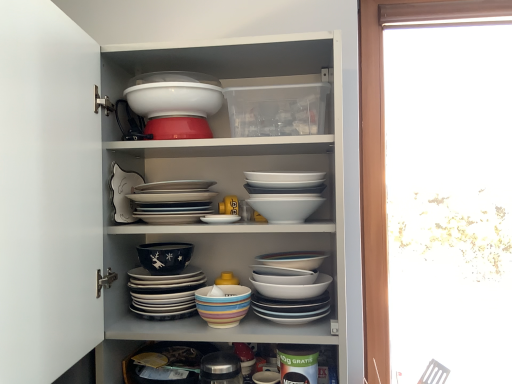
Question: From the image's perspective, is white glossy bowls at center, which is the sixth bowl in bottom-to-top order, positioned above or below white glossy plate at center, positioned as the fourth bowl in top-to-bottom order?

Choices:
 (A) above
 (B) below

Answer: (A)

Question: Based on their positions, is white glossy bowls at center, which is the sixth bowl in bottom-to-top order, located to the left or right of white glossy plate at center, positioned as the fourth bowl in top-to-bottom order?

Choices:
 (A) left
 (B) right

Answer: (B)

Question: Which object is the closest to the white glossy bowl at upper center, acting as the first bowl starting from the top?

Choices:
 (A) matte black bowl at center, the 5th bowl when ordered from top to bottom
 (B) multicolored ceramic bowl at center, marked as the 2th bowl in a bottom-to-top arrangement
 (C) multicolored ceramic bowl at center, the eighth bowl viewed from the top
 (D) white glossy bowls at upper center
 (E) white glossy plate at center, which ranks as the fifth bowl in bottom-to-top order

Answer: (E)

Question: Which object is positioned closest to the white glossy bowl at upper center, acting as the first bowl starting from the top?

Choices:
 (A) multicolored ceramic bowl at center, the eighth bowl viewed from the top
 (B) matte red bowl at upper center, which ranks as the seventh bowl in bottom-to-top order
 (C) white glossy bowls at upper center
 (D) multicolored ceramic bowls at center, arranged as the 6th bowl when viewed from the top
 (E) white glossy bowls at center, the third bowl positioned from the top

Answer: (B)